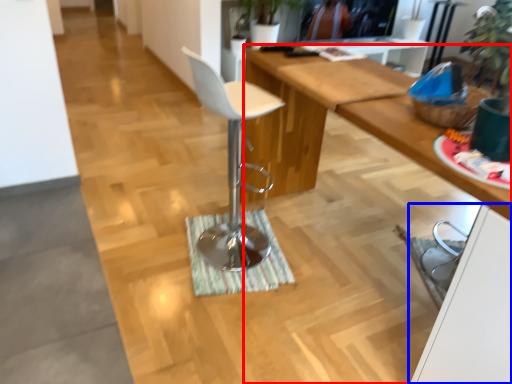
Question: Which object is closer to the camera taking this photo, desk (highlighted by a red box) or cabinetry (highlighted by a blue box)?

Choices:
 (A) desk
 (B) cabinetry

Answer: (B)